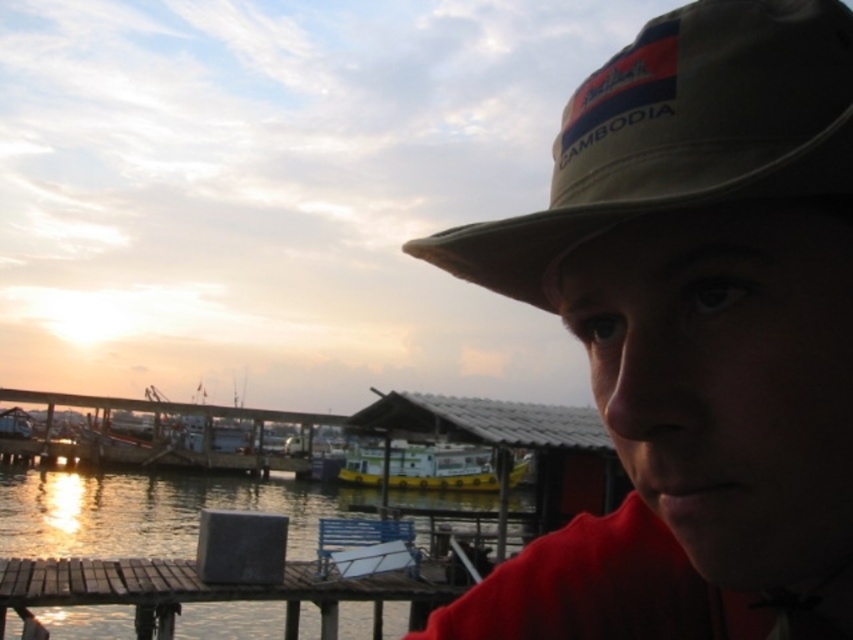
Is tan/cotton baseball hat at upper right below yellow rubber boat at center?

Actually, tan/cotton baseball hat at upper right is above yellow rubber boat at center.

Is tan/cotton baseball hat at upper right wider than yellow rubber boat at center?

No.

Is point (773, 188) positioned behind point (468, 456)?

That is False.

You are a GUI agent. You are given a task and a screenshot of the screen. Output one action in this format:
    pyautogui.click(x=<x>, y=<y>)
    Task: Click on the tan/cotton baseball hat at upper right
    
    Given the screenshot: What is the action you would take?
    pyautogui.click(x=679, y=134)

Is point (387, 579) less distant than point (393, 445)?

Yes, it is.

Is brown wooden dock at lower left further to camera compared to yellow rubber boat at center?

No, it is in front of yellow rubber boat at center.

Find the location of a particular element. The height and width of the screenshot is (640, 853). brown wooden dock at lower left is located at coordinates (199, 592).

Is tan canvas hat at upper right smaller than tan/cotton baseball hat at upper right?

Yes, tan canvas hat at upper right is smaller than tan/cotton baseball hat at upper right.

Does tan canvas hat at upper right appear on the left side of tan/cotton baseball hat at upper right?

Indeed, tan canvas hat at upper right is positioned on the left side of tan/cotton baseball hat at upper right.

At what (x,y) coordinates should I click in order to perform the action: click on tan canvas hat at upper right. Please return your answer as a coordinate pair (x, y). The image size is (853, 640). Looking at the image, I should click on (694, 330).